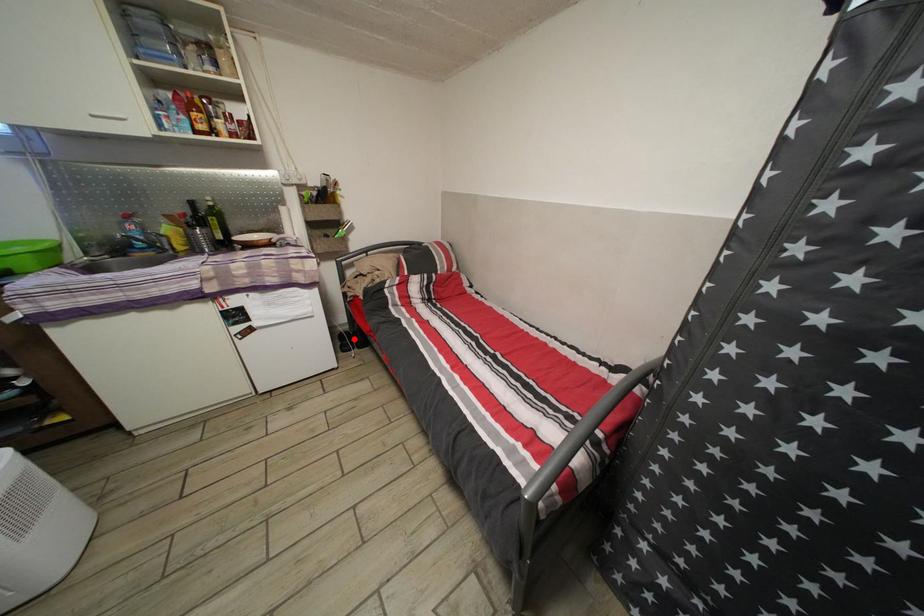
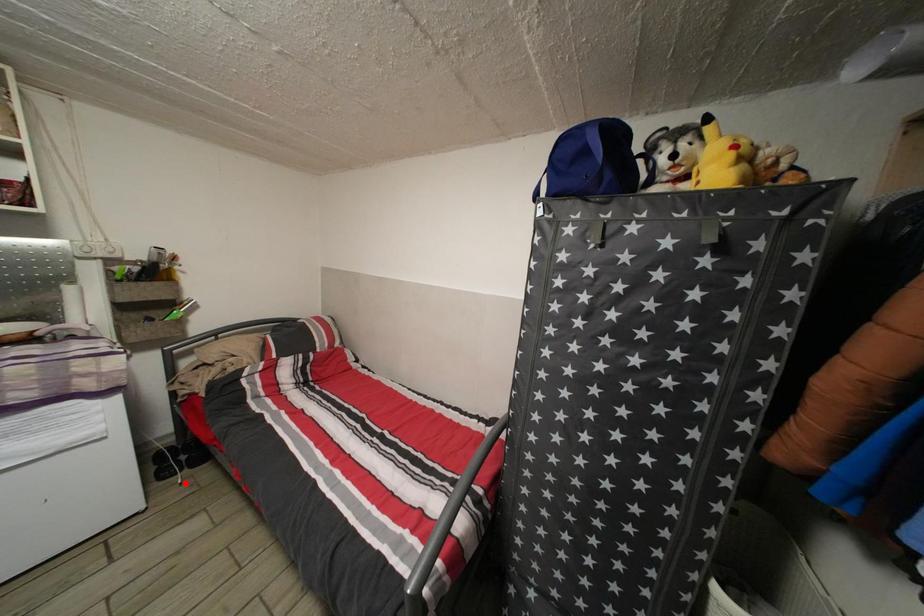
I am providing you with two images of the same scene from different viewpoints. A red point is marked on the first image and another point is marked on the second image. Does the point marked in image1 correspond to the same location as the one in image2?

No